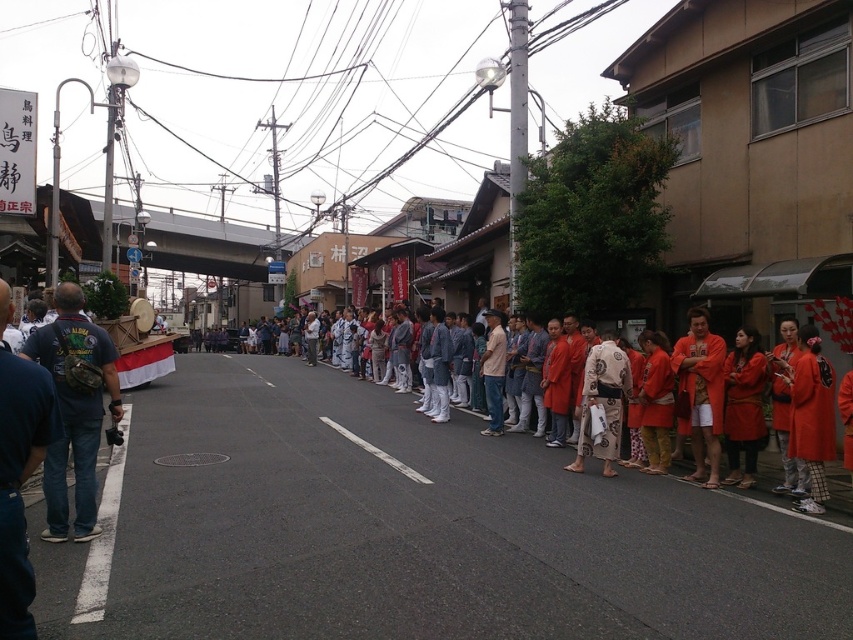
This screenshot has height=640, width=853. In order to click on orange kimono at right in this screenshot , I will do `click(811, 417)`.

Does point (813, 426) come farther from viewer compared to point (619, 365)?

No, (813, 426) is closer to viewer.

Locate an element on the screen. The image size is (853, 640). orange kimono at right is located at coordinates (811, 417).

Between dark blue t-shirt at left and matte red kimono at right, which one is positioned higher?

Positioned higher is dark blue t-shirt at left.

This screenshot has width=853, height=640. Find the location of `dark blue t-shirt at left`. dark blue t-shirt at left is located at coordinates (74, 419).

What do you see at coordinates (74, 419) in the screenshot? This screenshot has width=853, height=640. I see `dark blue t-shirt at left` at bounding box center [74, 419].

This screenshot has height=640, width=853. Identify the location of dark blue t-shirt at left. (74, 419).

Does dark blue t-shirt at left have a lesser height compared to white matte line at center?

In fact, dark blue t-shirt at left may be taller than white matte line at center.

Can you confirm if dark blue t-shirt at left is taller than white matte line at center?

Correct, dark blue t-shirt at left is much taller as white matte line at center.

Which is in front, point (67, 316) or point (248, 372)?

Point (67, 316) is in front.

Where is `dark blue t-shirt at left`? The image size is (853, 640). dark blue t-shirt at left is located at coordinates (74, 419).